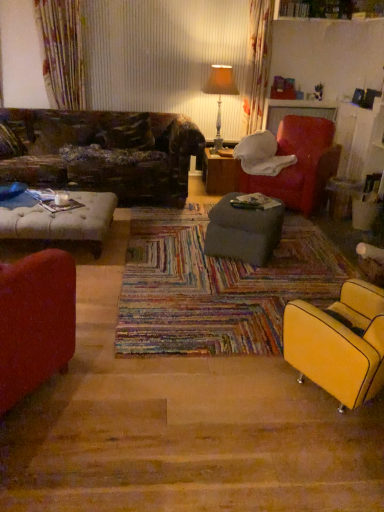
I want to click on free space in front of gray fabric ottoman at center, the 1th table viewed from the front, so click(x=238, y=278).